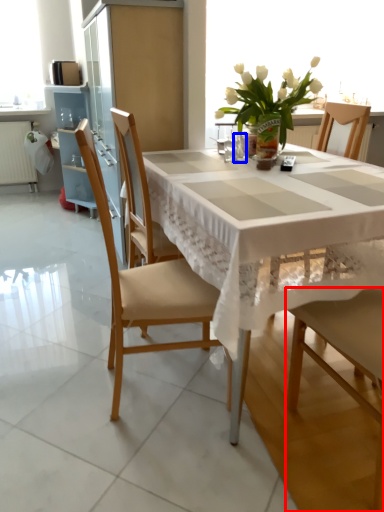
Question: Which object appears closest to the camera in this image, chair (highlighted by a red box) or tableware (highlighted by a blue box)?

Choices:
 (A) chair
 (B) tableware

Answer: (A)